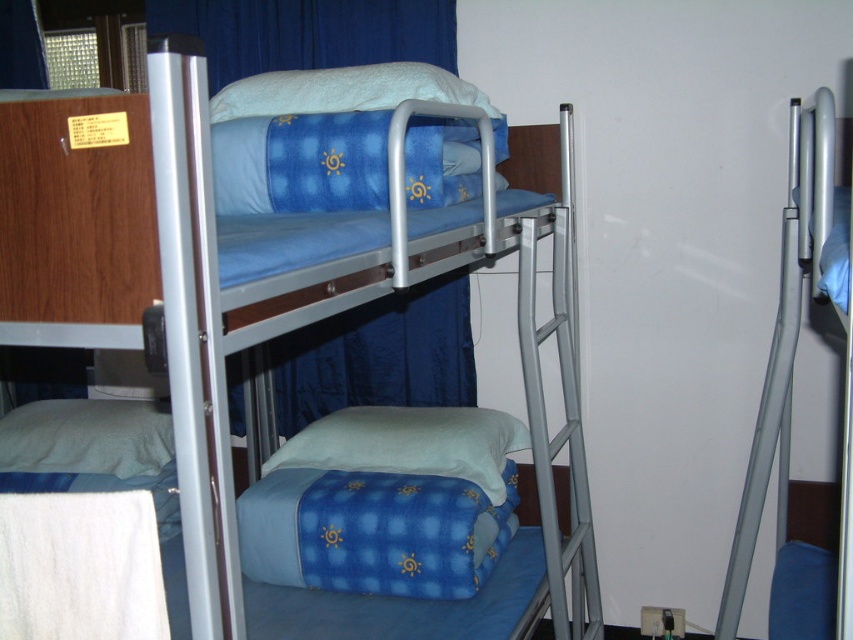
Does white soft pillow at lower left lie behind white soft pillow at upper center?

Yes, white soft pillow at lower left is behind white soft pillow at upper center.

Does white soft pillow at lower left appear over white soft pillow at upper center?

Actually, white soft pillow at lower left is below white soft pillow at upper center.

Does point (67, 445) lie in front of point (277, 77)?

That is False.

The image size is (853, 640). I want to click on white soft pillow at lower left, so click(86, 436).

Can you confirm if blue fabric curtain at center is taller than white soft pillow at upper center?

Correct, blue fabric curtain at center is much taller as white soft pillow at upper center.

Find the location of a particular element. This screenshot has height=640, width=853. blue fabric curtain at center is located at coordinates (378, 355).

Is blue fabric curtain at center bigger than soft blue fabric pillow at center?

Yes, blue fabric curtain at center is bigger than soft blue fabric pillow at center.

Measure the distance between point (413,362) and camera.

2.75 meters

Is point (465, 356) positioned before point (440, 452)?

No, it is behind (440, 452).

Image resolution: width=853 pixels, height=640 pixels. What are the coordinates of `blue fabric curtain at center` in the screenshot? It's located at (378, 355).